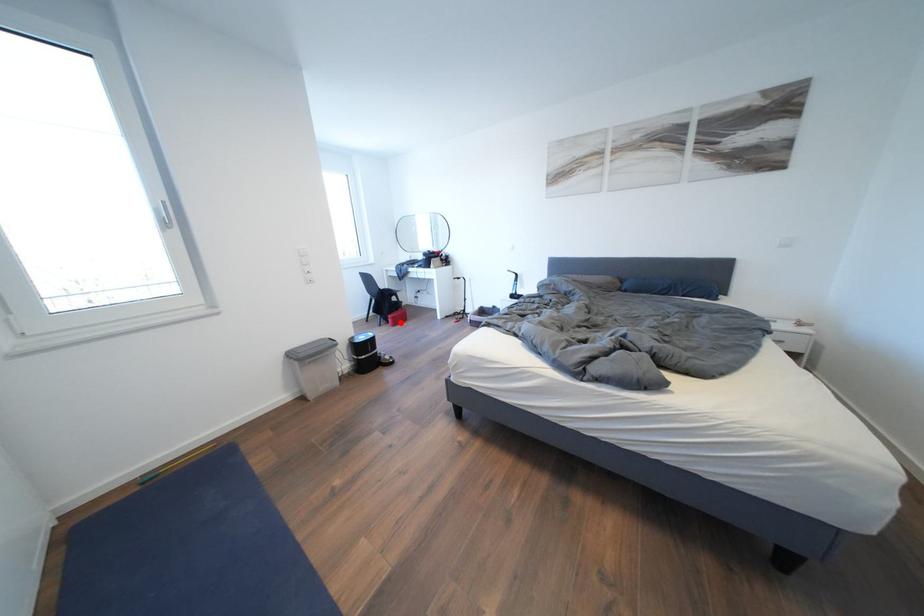
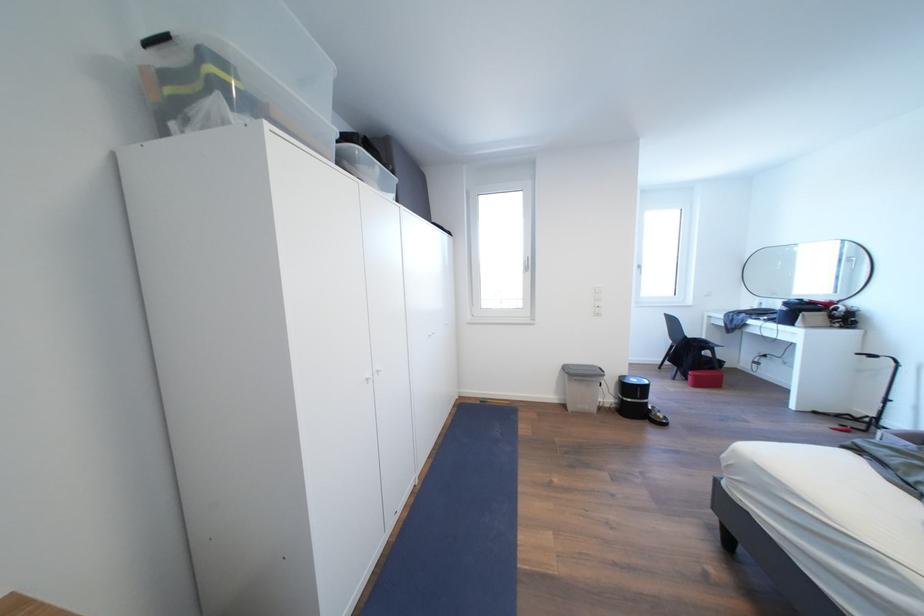
Locate, in the second image, the point that corresponds to the highlighted location in the first image.

(703, 381)